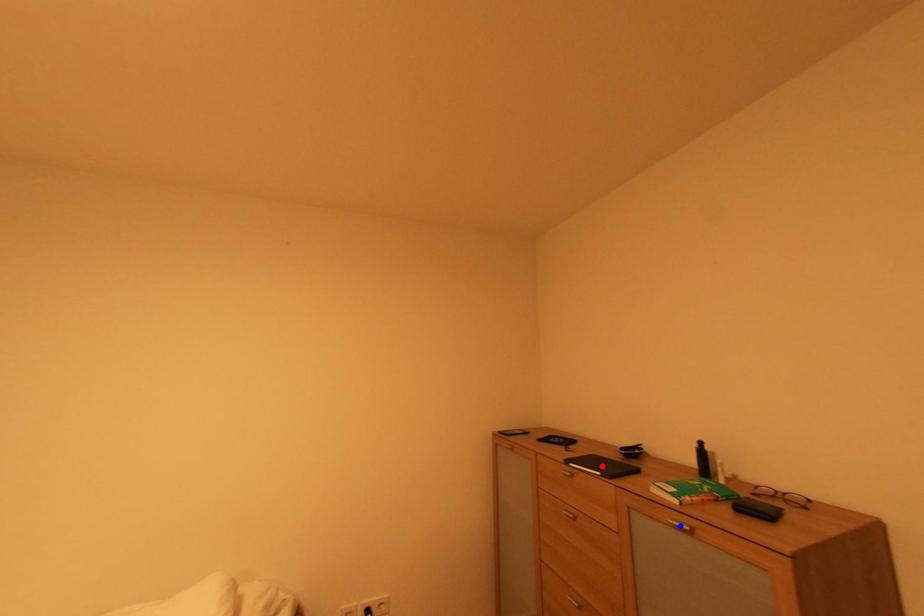
Question: In the image, two points are highlighted. Which point is nearer to the camera? Reply with the corresponding letter.

Choices:
 (A) blue point
 (B) red point

Answer: (A)